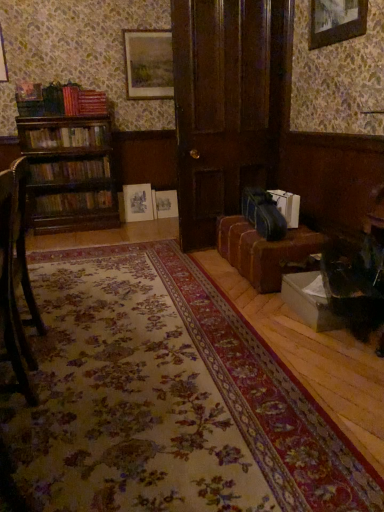
Where is `free point above wooden bookshelf at left, which is counted as the 2th book, starting from the back (from a real-world perspective)`? Image resolution: width=384 pixels, height=512 pixels. free point above wooden bookshelf at left, which is counted as the 2th book, starting from the back (from a real-world perspective) is located at coordinates (76, 155).